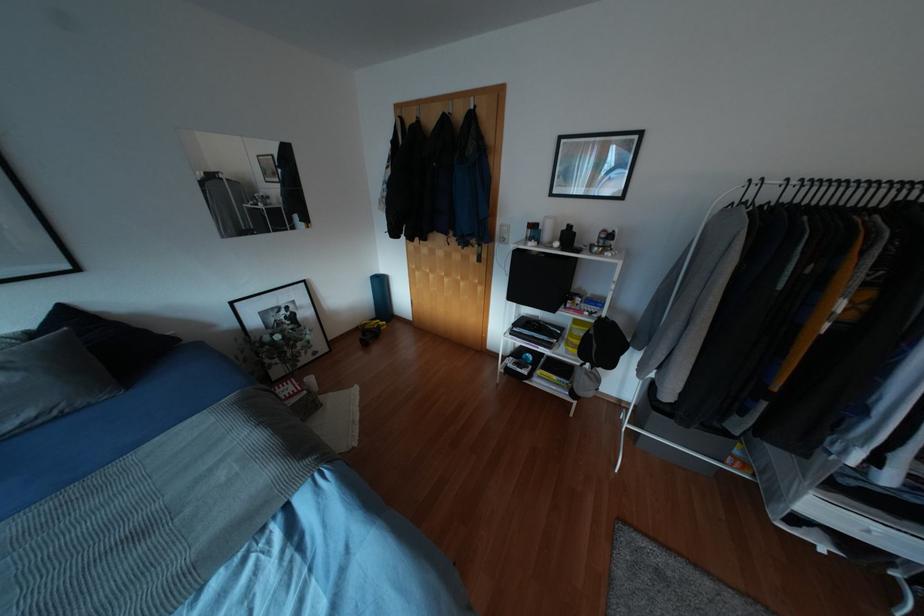
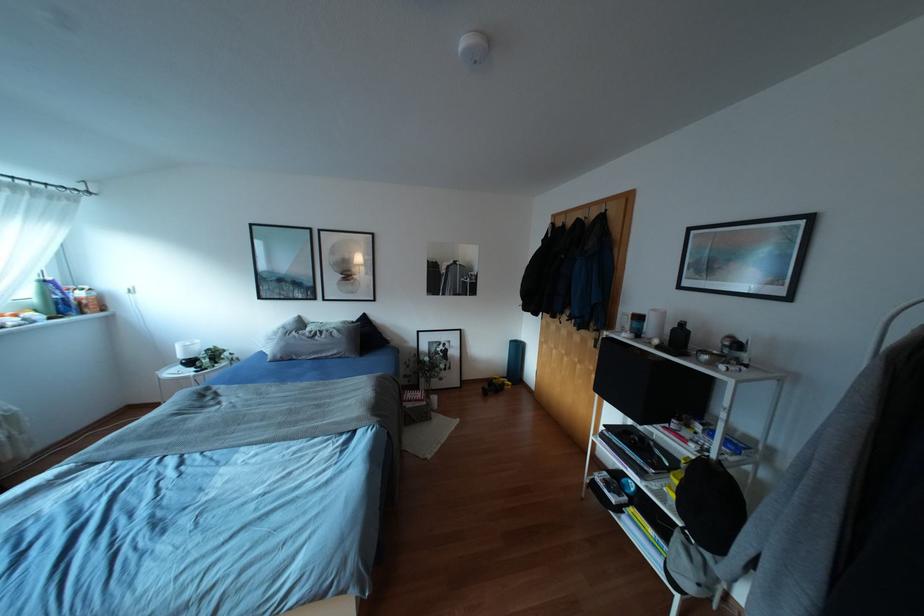
The point at (x=568, y=225) is marked in the first image. Where is the corresponding point in the second image?

(682, 323)